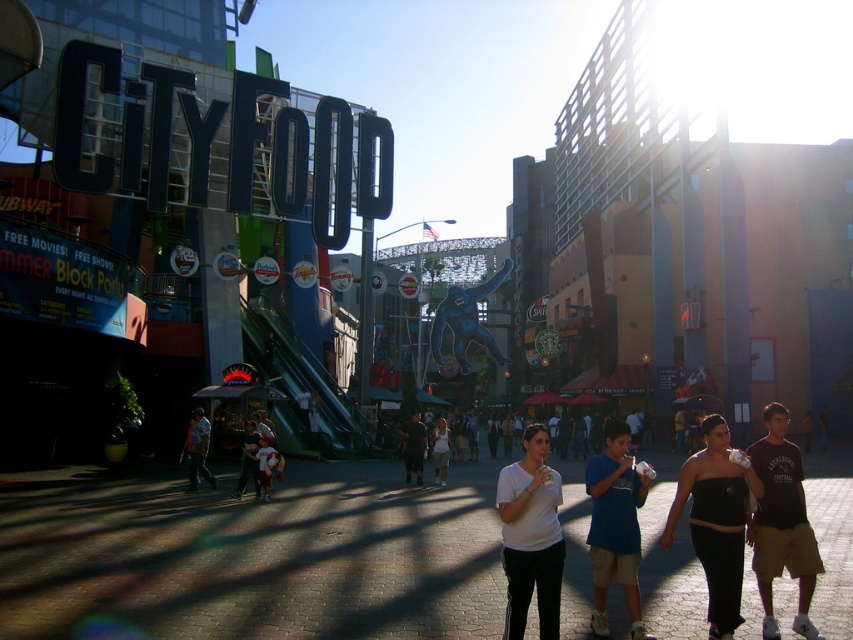
Which is more to the left, dark brown cotton t-shirt at center-right or brown leather jacket at center?

brown leather jacket at center is more to the left.

Can you confirm if dark brown cotton t-shirt at center-right is taller than brown leather jacket at center?

Yes.

Who is more distant from viewer, [772,440] or [415,433]?

Positioned behind is point [415,433].

Find the location of `dark brown cotton t-shirt at center-right`. dark brown cotton t-shirt at center-right is located at coordinates (781, 524).

Consider the image. Does black strapless dress at center appear on the left side of blue denim jeans at center?

Incorrect, black strapless dress at center is not on the left side of blue denim jeans at center.

Between black strapless dress at center and blue denim jeans at center, which one has less height?

Standing shorter between the two is blue denim jeans at center.

Locate an element on the screen. The width and height of the screenshot is (853, 640). black strapless dress at center is located at coordinates (715, 522).

Can you confirm if dark brown cotton t-shirt at center-right is shorter than blue cotton shirt at center?

No.

The width and height of the screenshot is (853, 640). Identify the location of dark brown cotton t-shirt at center-right. (781, 524).

I want to click on dark brown cotton t-shirt at center-right, so click(x=781, y=524).